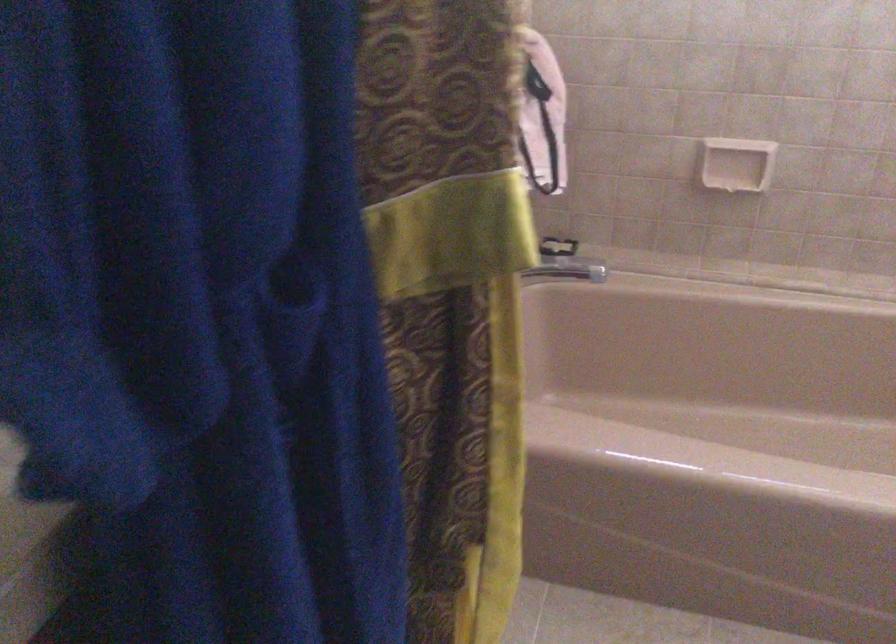
Find the location of a particular element. metal faucet lever is located at coordinates (569, 269).